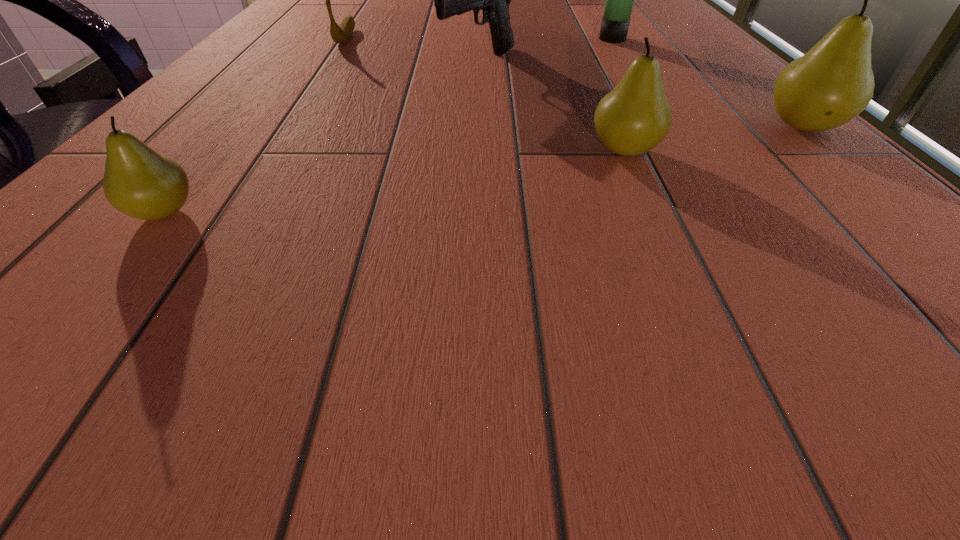
Identify the location of the second shortest object. The height and width of the screenshot is (540, 960). (138, 181).

This screenshot has height=540, width=960. Find the location of `the nearest pear`. the nearest pear is located at coordinates (138, 181).

Identify the location of the second shortest pear. (632, 119).

At what (x,y) coordinates should I click in order to perform the action: click on the fourth object from left to right. Please return your answer as a coordinate pair (x, y). The image size is (960, 540). Looking at the image, I should click on (632, 119).

Identify the location of the second tallest object. The image size is (960, 540). (831, 84).

The width and height of the screenshot is (960, 540). What are the coordinates of `the tallest pear` in the screenshot? It's located at (831, 84).

This screenshot has width=960, height=540. I want to click on the second object from left to right, so click(x=340, y=34).

Locate an element on the screen. the shortest object is located at coordinates (340, 34).

I want to click on the second object from right to left, so click(x=615, y=23).

Image resolution: width=960 pixels, height=540 pixels. What are the coordinates of `the tallest object` in the screenshot? It's located at (615, 23).